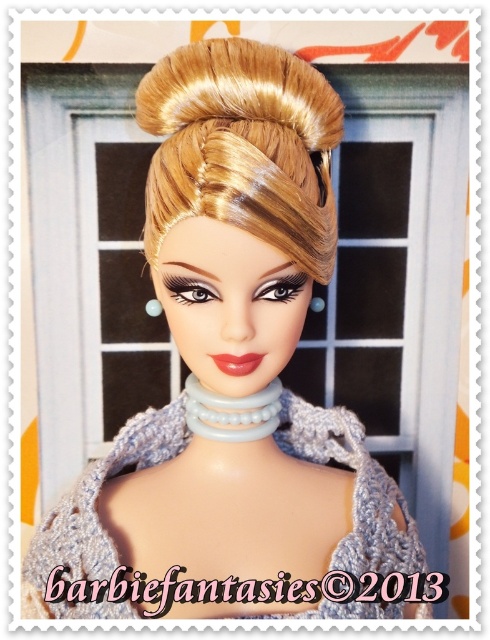
You are a stylist preparing to style the doll for a photoshoot. You need to decide which item to adjust first based on their thickness. Which object should you handle first, the blonde shiny hair bun at upper center or the crochet fabric dress at center?

The blonde shiny hair bun at upper center is thinner than the crochet fabric dress at center, so you should handle the crochet fabric dress at center first since it is thicker and may require more adjustments.

You are an artist trying to sketch the doll. You need to place the hair bun exactly at the center of your canvas. Based on the image, is the current position of the blonde shiny hair bun at upper center centered horizontally and vertically?

The position of the blonde shiny hair bun at upper center is at point [243,147]. Since the center of the canvas would be at [245,320], the bun is not centered as its coordinates are less than 0.5 in both axes.

You are an artist trying to sketch the doll. You need to decide which of the two points, point (196, 200) or point (356, 564), should be drawn first based on their depth. Which point should you start with?

Point (196, 200) is closer to the viewer than point (356, 564), so you should start drawing point (196, 200) first to establish the foreground elements before moving to the background.